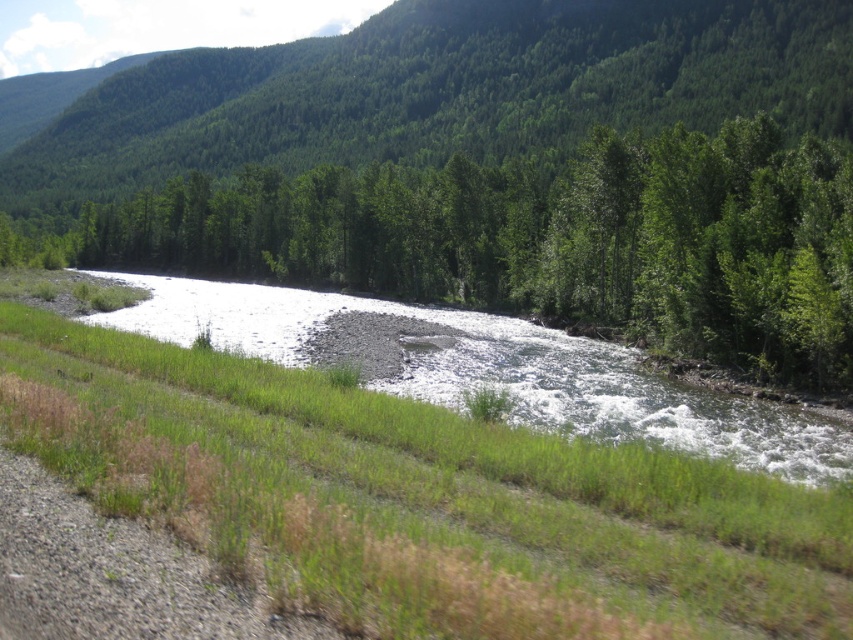
You are planning to set up a tent for a camping trip and want to choose a spot that is sheltered from the wind. Which location would be better between the green leafy tree at center and the white gravel river at center?

The green leafy tree at center is much taller than the white gravel river at center, so setting up the tent near the green leafy tree at center would provide better shelter from the wind due to its height and foliage.

Looking at this image, you are standing at the edge of the green leafy tree at center and want to cross to the white gravel river at center. If your walking distance is limited to 25 meters, can you reach the river without moving further than that?

The green leafy tree at center is 30.23 meters away from the white gravel river at center. Since your walking distance is limited to 25 meters, you cannot reach the river without exceeding your limit.

You are a hiker planning to cross the river using a narrow path between the green leafy tree at center and the green leafy tree at upper center. Which tree should you avoid if you want to stay closer to the riverbank?

You should avoid the green leafy tree at upper center because the green leafy tree at center is smaller and closer to the riverbank.